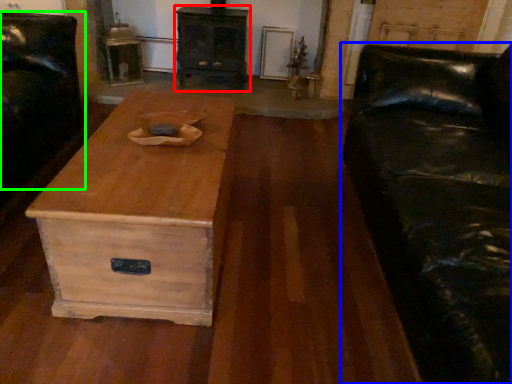
Question: Which object is the closest to the chest of drawers (highlighted by a red box)? Choose among these: studio couch (highlighted by a blue box) or armchair (highlighted by a green box).

Choices:
 (A) studio couch
 (B) armchair

Answer: (B)